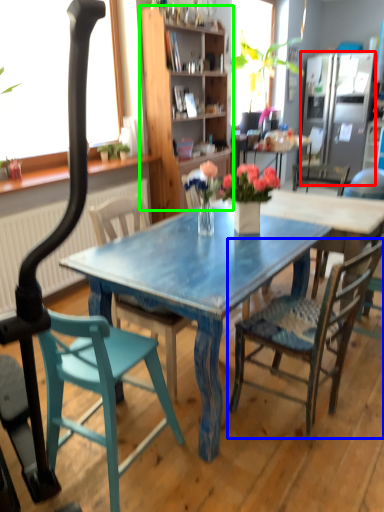
Question: Considering the real-world distances, which object is closest to refrigerator (highlighted by a red box)? chair (highlighted by a blue box) or cabinetry (highlighted by a green box).

Choices:
 (A) chair
 (B) cabinetry

Answer: (B)